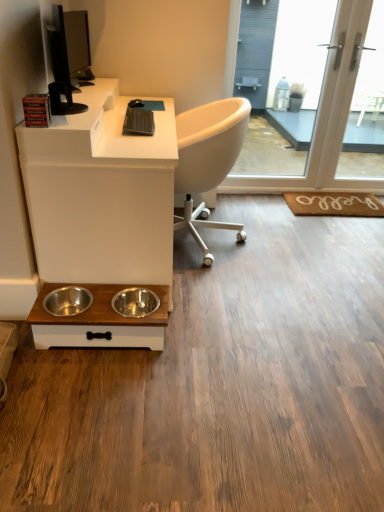
Question: From the image's perspective, is stainless steel bowls at lower center located above or below black glossy monitor at upper left?

Choices:
 (A) below
 (B) above

Answer: (A)

Question: Is stainless steel bowls at lower center inside or outside of black glossy monitor at upper left?

Choices:
 (A) outside
 (B) inside

Answer: (A)

Question: Which of these objects is positioned closest to the white matte desk at lower left?

Choices:
 (A) stainless steel bowls at lower center
 (B) black glossy monitor at upper left
 (C) transparent glass screen door at upper right, positioned as the first screen door in left-to-right order
 (D) brown woven mat at lower right
 (E) white glass screen door at upper right, which ranks as the second screen door in left-to-right order

Answer: (A)

Question: Which is farther from the white glass screen door at upper right, the first screen door from the right?

Choices:
 (A) white matte desk at lower left
 (B) stainless steel bowls at lower center
 (C) brown woven mat at lower right
 (D) black glossy monitor at upper left
 (E) transparent glass screen door at upper right, positioned as the first screen door in left-to-right order

Answer: (B)